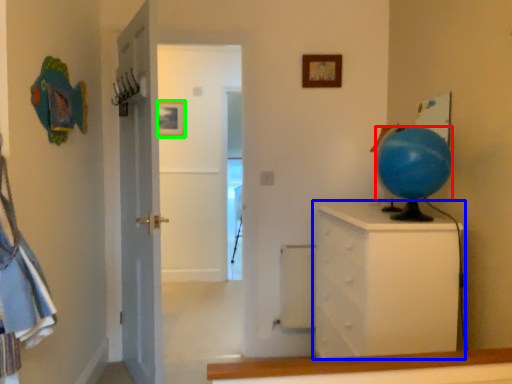
Question: Based on their relative distances, which object is nearer to balloon (highlighted by a red box)? Choose from chest of drawers (highlighted by a blue box) and picture frame (highlighted by a green box).

Choices:
 (A) chest of drawers
 (B) picture frame

Answer: (A)